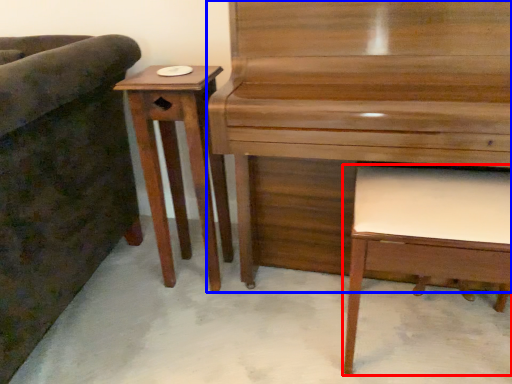
Question: Which point is further to the camera, music stool (highlighted by a red box) or piano (highlighted by a blue box)?

Choices:
 (A) music stool
 (B) piano

Answer: (A)